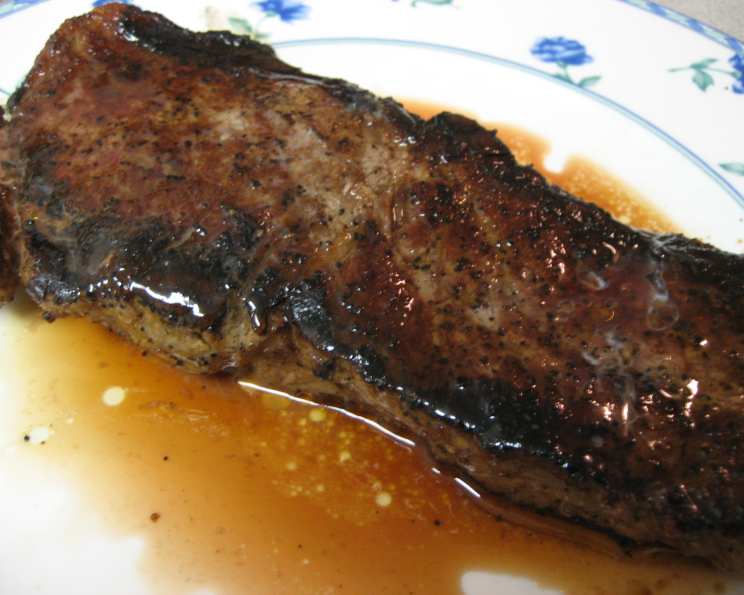
You are a GUI agent. You are given a task and a screenshot of the screen. Output one action in this format:
    pyautogui.click(x=<x>, y=<y>)
    Task: Click on the plate
    
    Given the screenshot: What is the action you would take?
    pyautogui.click(x=541, y=112)